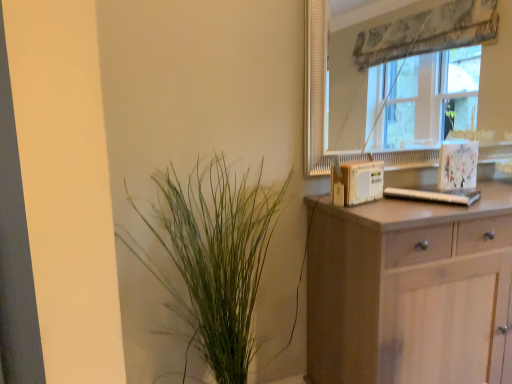
What do you see at coordinates (213, 258) in the screenshot?
I see `green leafy plant at left` at bounding box center [213, 258].

Locate an element on the screen. The height and width of the screenshot is (384, 512). green leafy plant at left is located at coordinates (213, 258).

You are a GUI agent. You are given a task and a screenshot of the screen. Output one action in this format:
    pyautogui.click(x=<x>, y=<y>)
    Task: Click on the transparent glass window at upper right
    The height and width of the screenshot is (384, 512).
    Given the screenshot: What is the action you would take?
    pyautogui.click(x=349, y=87)

Image resolution: width=512 pixels, height=384 pixels. I want to click on light brown wooden chest of drawers at right, so click(x=409, y=290).

Would you say green leafy plant at left is a long distance from transparent glass window at upper right?

That's right, there is a large distance between green leafy plant at left and transparent glass window at upper right.

Does green leafy plant at left contain transparent glass window at upper right?

Actually, transparent glass window at upper right is outside green leafy plant at left.

Choose the correct answer: Is transparent glass window at upper right inside green leafy plant at left or outside it?

transparent glass window at upper right is spatially situated outside green leafy plant at left.

Which is in front, transparent glass window at upper right or green leafy plant at left?

green leafy plant at left is closer to the camera.

In the scene shown: Is transparent glass window at upper right to the right of green leafy plant at left from the viewer's perspective?

Indeed, transparent glass window at upper right is positioned on the right side of green leafy plant at left.

Considering the relative sizes of transparent glass window at upper right and green leafy plant at left in the image provided, is transparent glass window at upper right bigger than green leafy plant at left?

Incorrect, transparent glass window at upper right is not larger than green leafy plant at left.

Can we say light brown wooden chest of drawers at right lies outside transparent glass window at upper right?

Yes, light brown wooden chest of drawers at right is not within transparent glass window at upper right.

Considering the sizes of light brown wooden chest of drawers at right and transparent glass window at upper right in the image, is light brown wooden chest of drawers at right wider or thinner than transparent glass window at upper right?

light brown wooden chest of drawers at right is wider than transparent glass window at upper right.

Is light brown wooden chest of drawers at right facing away from transparent glass window at upper right?

No.

Are light brown wooden chest of drawers at right and transparent glass window at upper right located far from each other?

Yes, light brown wooden chest of drawers at right and transparent glass window at upper right are located far from each other.

Considering the sizes of objects transparent glass window at upper right and light brown wooden chest of drawers at right in the image provided, who is smaller, transparent glass window at upper right or light brown wooden chest of drawers at right?

With smaller size is transparent glass window at upper right.

Relative to light brown wooden chest of drawers at right, is transparent glass window at upper right in front or behind?

In the image, transparent glass window at upper right appears behind light brown wooden chest of drawers at right.

Is transparent glass window at upper right wider or thinner than light brown wooden chest of drawers at right?

transparent glass window at upper right is thinner than light brown wooden chest of drawers at right.

Is transparent glass window at upper right next to light brown wooden chest of drawers at right?

transparent glass window at upper right and light brown wooden chest of drawers at right are not in contact.

From a real-world perspective, between light brown wooden chest of drawers at right and green leafy plant at left, who is vertically lower?

From a 3D spatial view, light brown wooden chest of drawers at right is below.

Which of these two, light brown wooden chest of drawers at right or green leafy plant at left, is thinner?

green leafy plant at left.

Does light brown wooden chest of drawers at right turn towards green leafy plant at left?

No, light brown wooden chest of drawers at right is not facing towards green leafy plant at left.

Looking at their sizes, would you say green leafy plant at left is wider or thinner than light brown wooden chest of drawers at right?

Considering their sizes, green leafy plant at left looks slimmer than light brown wooden chest of drawers at right.

Where is `houseplant lying above the light brown wooden chest of drawers at right (from the image's perspective)`? This screenshot has width=512, height=384. houseplant lying above the light brown wooden chest of drawers at right (from the image's perspective) is located at coordinates (213, 258).

From the picture: Is green leafy plant at left bigger or smaller than light brown wooden chest of drawers at right?

green leafy plant at left is smaller than light brown wooden chest of drawers at right.

Locate an element on the screen. The width and height of the screenshot is (512, 384). houseplant in front of the transparent glass window at upper right is located at coordinates 213,258.

Identify the location of houseplant that is under the transparent glass window at upper right (from a real-world perspective). The height and width of the screenshot is (384, 512). (213, 258).

Looking at the image, which one is located closer to green leafy plant at left, transparent glass window at upper right or light brown wooden chest of drawers at right?

light brown wooden chest of drawers at right is closer to green leafy plant at left.

When comparing their distances from transparent glass window at upper right, does green leafy plant at left or light brown wooden chest of drawers at right seem closer?

Among the two, light brown wooden chest of drawers at right is located nearer to transparent glass window at upper right.

Based on the photo, based on their spatial positions, is green leafy plant at left or transparent glass window at upper right closer to light brown wooden chest of drawers at right?

green leafy plant at left is positioned closer to the anchor light brown wooden chest of drawers at right.

Based on their spatial positions, is transparent glass window at upper right or green leafy plant at left closer to light brown wooden chest of drawers at right?

Based on the image, green leafy plant at left appears to be nearer to light brown wooden chest of drawers at right.

Considering their positions, is light brown wooden chest of drawers at right positioned closer to green leafy plant at left than transparent glass window at upper right?

Based on the image, light brown wooden chest of drawers at right appears to be nearer to green leafy plant at left.

Looking at this image, when comparing their distances from transparent glass window at upper right, does light brown wooden chest of drawers at right or green leafy plant at left seem further?

The object further to transparent glass window at upper right is green leafy plant at left.

Locate an element on the screen. This screenshot has height=384, width=512. window located between green leafy plant at left and light brown wooden chest of drawers at right in the left-right direction is located at coordinates (349, 87).